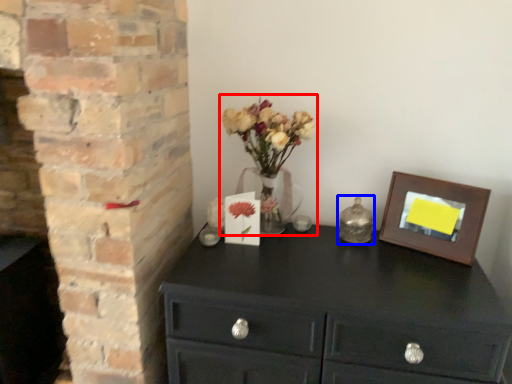
Question: Among these objects, which one is nearest to the camera, floral arrangement (highlighted by a red box) or candle holder (highlighted by a blue box)?

Choices:
 (A) floral arrangement
 (B) candle holder

Answer: (A)